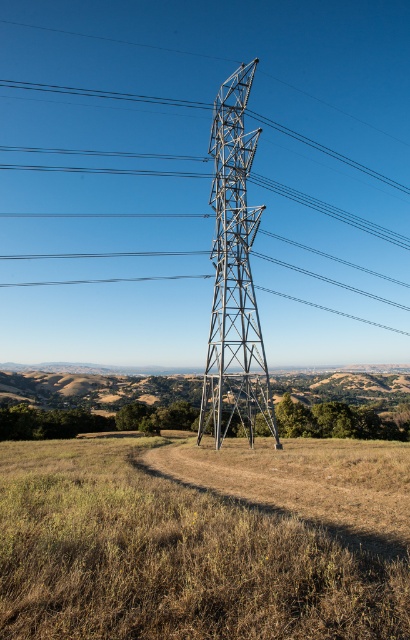
Question: Can you confirm if brown dry grass at center is positioned to the left of metallic gray tower at center?

Choices:
 (A) no
 (B) yes

Answer: (B)

Question: Can you confirm if brown dry grass at center is positioned to the right of metallic gray tower at center?

Choices:
 (A) no
 (B) yes

Answer: (A)

Question: Which of the following is the closest to the observer?

Choices:
 (A) brown dry grass at center
 (B) metallic gray tower at center

Answer: (A)

Question: Which point appears closest to the camera in this image?

Choices:
 (A) (100, 604)
 (B) (232, 136)

Answer: (A)

Question: Does brown dry grass at center appear over metallic gray tower at center?

Choices:
 (A) yes
 (B) no

Answer: (B)

Question: Which object is closer to the camera taking this photo?

Choices:
 (A) brown dry grass at center
 (B) metallic gray tower at center

Answer: (A)